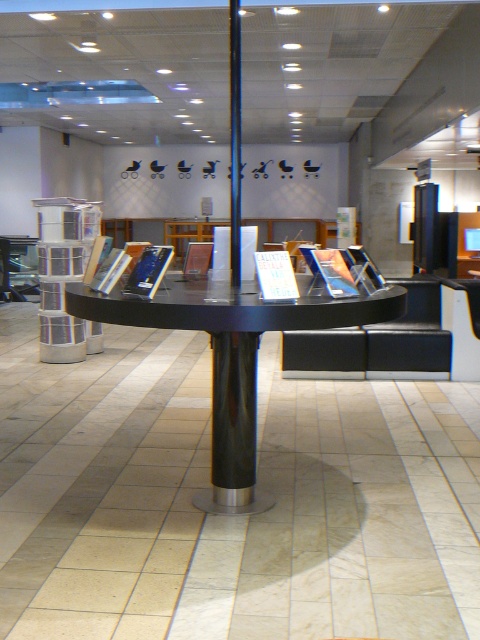
You are standing in the library and want to place a new book on the closest object to you. Which object should you choose between the black glossy table at center and the metallic cylindrical stack at left?

The black glossy table at center is closer to the viewer than the metallic cylindrical stack at left, so you should place the new book on the black glossy table at center.

You are a librarian who needs to place a new book on the black glossy table at center. However, there is a black glossy pillar at center in the way. Can you place the book directly on the table without moving the pillar?

The black glossy table at center is located below the black glossy pillar at center, so you can place the book directly on the table without moving the pillar since the pillar is above it and does not block access to the table.